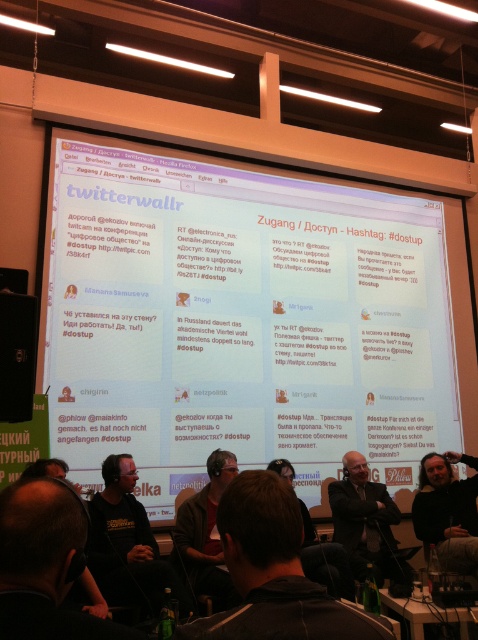
Which is behind, point (364, 548) or point (185, 547)?

The point (364, 548) is behind.

Who is lower down, black leather jacket at center or brown leather jacket at center?

black leather jacket at center

At what (x,y) coordinates should I click in order to perform the action: click on black leather jacket at center. Please return your answer as a coordinate pair (x, y). This screenshot has height=640, width=478. Looking at the image, I should click on (366, 522).

Find the location of a particular element. The image size is (478, 640). black leather jacket at center is located at coordinates (366, 522).

Is dark brown leather jacket at lower left shorter than black leather jacket at center?

Yes.

Where is `dark brown leather jacket at lower left`? The image size is (478, 640). dark brown leather jacket at lower left is located at coordinates point(44,564).

Looking at this image, is brown leather jacket at center smaller than dark gray suit at center?

No, brown leather jacket at center is not smaller than dark gray suit at center.

Does brown leather jacket at center appear under dark gray suit at center?

No.

Find the location of a particular element. This screenshot has width=478, height=640. brown leather jacket at center is located at coordinates (205, 534).

Locate an element on the screen. This screenshot has height=640, width=478. brown leather jacket at center is located at coordinates click(205, 534).